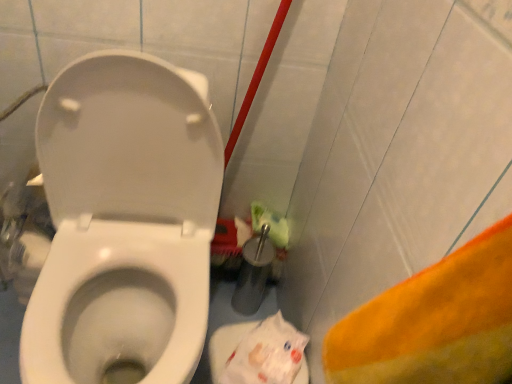
This screenshot has width=512, height=384. Find the location of `vacant space situated above white plastic bag at lower right (from a real-world perspective)`. vacant space situated above white plastic bag at lower right (from a real-world perspective) is located at coordinates (274, 347).